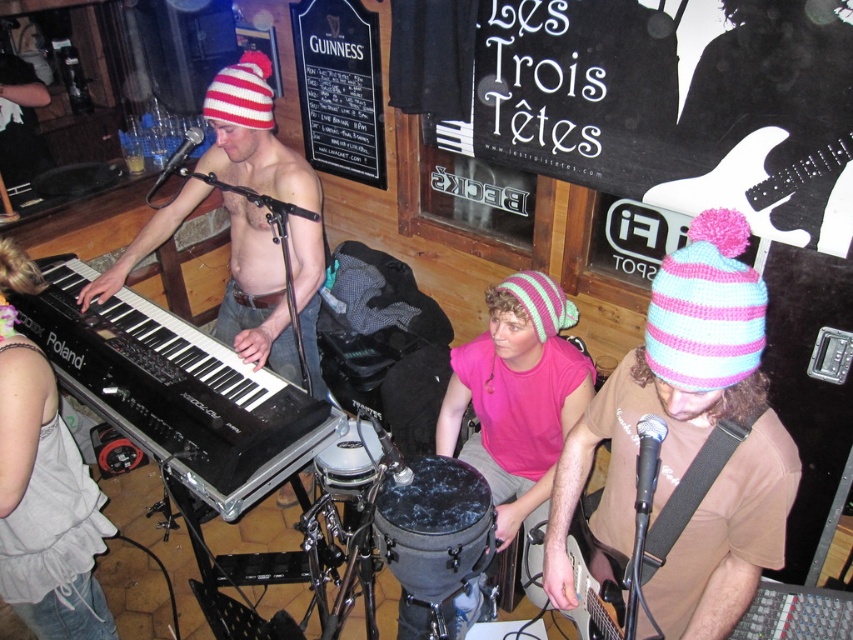
Question: Which object is farther from the camera taking this photo?

Choices:
 (A) matte black keyboard at left
 (B) pink knitted hat at center

Answer: (A)

Question: Which of these objects is positioned closest to the striped knit beanie at upper left?

Choices:
 (A) pink and light blue knitted beanie at right
 (B) pink knitted beanie at center
 (C) pink knit beanie at center
 (D) shiny black keyboard at left

Answer: (D)

Question: Which of the following is the farthest from the observer?

Choices:
 (A) (24, 259)
 (B) (656, 397)
 (C) (241, 115)

Answer: (C)

Question: Does black chalkboard at upper center have a lesser width compared to pink knitted beanie at center?

Choices:
 (A) yes
 (B) no

Answer: (B)

Question: Does pink knit beanie at center have a larger size compared to pink and light blue knitted beanie at right?

Choices:
 (A) yes
 (B) no

Answer: (A)

Question: Can you confirm if pink knit beanie at center is wider than pink knitted beanie at center?

Choices:
 (A) no
 (B) yes

Answer: (B)